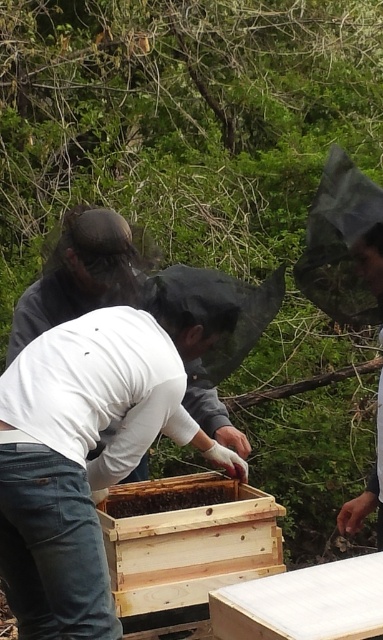
Question: Does wooden beehive at center appear on the left side of white matte shirt at center?

Choices:
 (A) yes
 (B) no

Answer: (B)

Question: Which object is closer to the camera taking this photo?

Choices:
 (A) white matte shirt at center
 (B) wooden beehive at center

Answer: (B)

Question: Does white matte shirt at center have a larger size compared to brown wooden beehive at center?

Choices:
 (A) no
 (B) yes

Answer: (B)

Question: Considering the real-world distances, which object is closest to the white matte shirt at center?

Choices:
 (A) wooden beehive at center
 (B) brown wooden beehive at center

Answer: (B)

Question: Which object appears farthest from the camera in this image?

Choices:
 (A) wooden beehive at center
 (B) white matte shirt at center
 (C) brown wooden beehive at center

Answer: (C)

Question: Is wooden beehive at center positioned before brown wooden beehive at center?

Choices:
 (A) yes
 (B) no

Answer: (A)